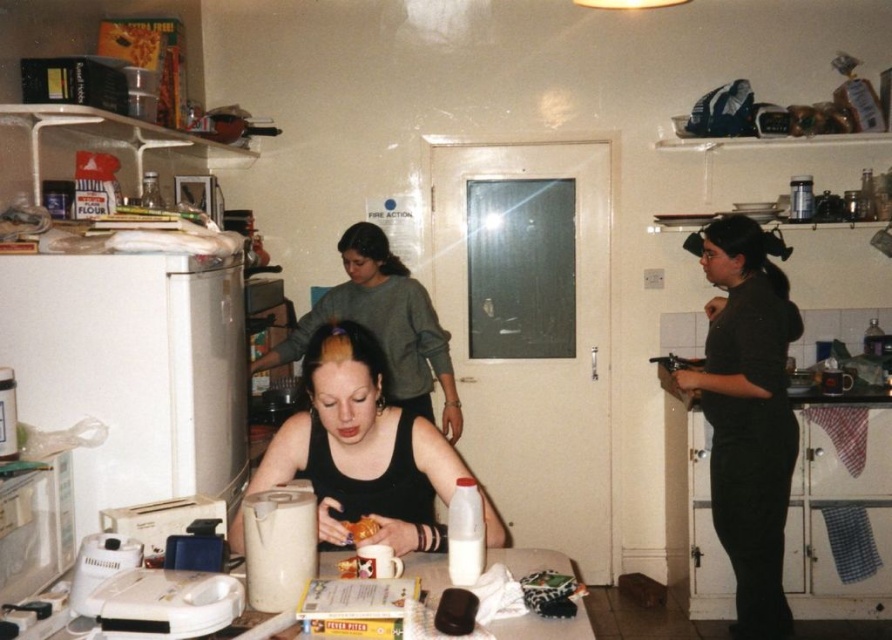
Can you confirm if black matte shirt at right is positioned to the right of white plastic toaster at lower left?

Indeed, black matte shirt at right is positioned on the right side of white plastic toaster at lower left.

Locate an element on the screen. The height and width of the screenshot is (640, 892). black matte shirt at right is located at coordinates (x=747, y=416).

Where is `black matte shirt at right`? This screenshot has height=640, width=892. black matte shirt at right is located at coordinates (747, 416).

Can you confirm if white plastic milk bottle at center is smaller than clear glass bottle at upper left?

Indeed, white plastic milk bottle at center has a smaller size compared to clear glass bottle at upper left.

Which is behind, point (478, 560) or point (147, 204)?

Point (147, 204)

The image size is (892, 640). What do you see at coordinates (465, 532) in the screenshot? I see `white plastic milk bottle at center` at bounding box center [465, 532].

Find the location of a particular element. This screenshot has height=640, width=892. white plastic milk bottle at center is located at coordinates (465, 532).

Measure the distance from white plastic refrigerator at left to white plastic kettle at lower center.

56.49 centimeters

Is white plastic refrigerator at left smaller than white plastic kettle at lower center?

Actually, white plastic refrigerator at left might be larger than white plastic kettle at lower center.

Who is more distant from viewer, (68, 301) or (271, 554)?

Positioned behind is point (68, 301).

Locate an element on the screen. Image resolution: width=892 pixels, height=640 pixels. white plastic refrigerator at left is located at coordinates (133, 371).